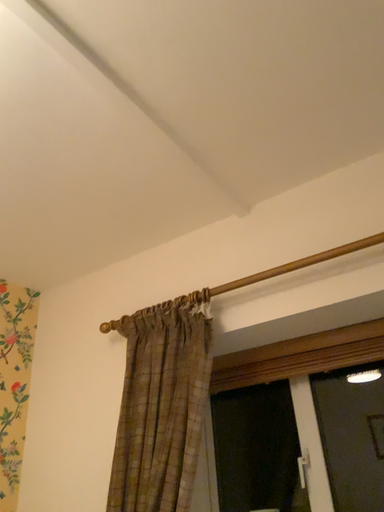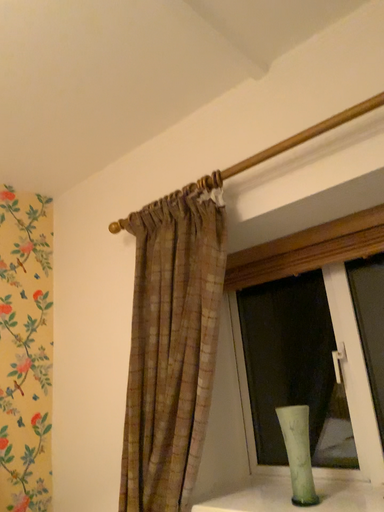
Question: Which way did the camera rotate in the video?

Choices:
 (A) rotated upward
 (B) rotated downward

Answer: (B)